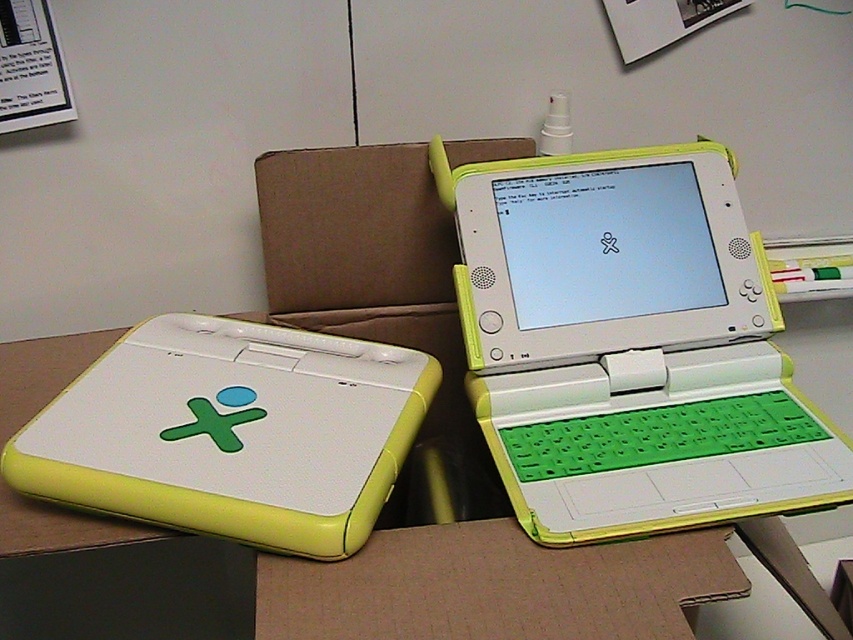
Does point (573, 177) lie in front of point (436, 356)?

Yes, point (573, 177) is in front of point (436, 356).

Find the location of `matte white laptop at center`. matte white laptop at center is located at coordinates (628, 344).

Who is more distant from viewer, (700,195) or (310,253)?

The point (310,253) is more distant.

I want to click on matte white laptop at center, so click(x=628, y=344).

Looking at this image, can you confirm if white matte laptop at lower left is positioned below brown cardboard at center?

Indeed, white matte laptop at lower left is positioned under brown cardboard at center.

Does white matte laptop at lower left have a larger size compared to brown cardboard at center?

Yes, white matte laptop at lower left is bigger than brown cardboard at center.

Is point (79, 499) positioned before point (306, 237)?

Yes, it is in front of point (306, 237).

Where is `white matte laptop at lower left`? The width and height of the screenshot is (853, 640). white matte laptop at lower left is located at coordinates (231, 433).

Does point (506, 200) lie behind point (276, 422)?

Yes, point (506, 200) is farther from viewer.

Who is more distant from viewer, (581, 458) or (340, 412)?

Positioned behind is point (340, 412).

This screenshot has width=853, height=640. Identify the location of matte white laptop at center. (628, 344).